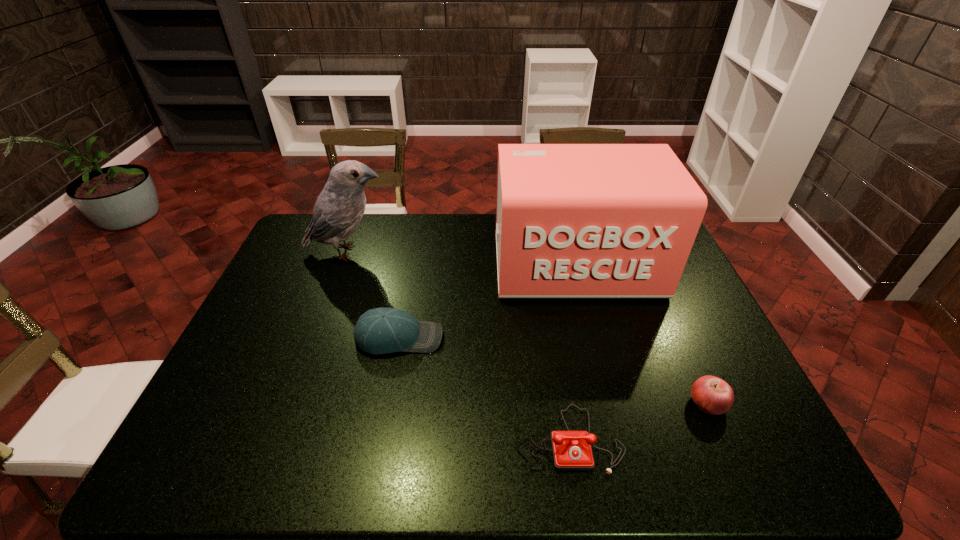
I want to click on vacant area that lies between the shortest object and the apple, so click(638, 421).

Locate an element on the screen. Image resolution: width=960 pixels, height=540 pixels. free space between the telephone and the third farthest object is located at coordinates (484, 388).

Where is `the third closest object to the parrot`? The width and height of the screenshot is (960, 540). the third closest object to the parrot is located at coordinates (571, 450).

Identify which object is the fourth nearest to the parrot. Please provide its 2D coordinates. Your answer should be formatted as a tuple, i.e. [(x, y)], where the tuple contains the x and y coordinates of a point satisfying the conditions above.

[(712, 395)]

The height and width of the screenshot is (540, 960). Identify the location of vacant space that satisfies the following two spatial constraints: 1. on the front-facing side of the third farthest object; 2. on the right side of the parrot. (317, 338).

I want to click on vacant area in the image that satisfies the following two spatial constraints: 1. on the front-facing side of the parrot; 2. on the left side of the apple, so click(293, 403).

Find the location of a particular element. free region that satisfies the following two spatial constraints: 1. on the front-facing side of the parrot; 2. on the back side of the apple is located at coordinates (293, 403).

Where is `vacant area in the image that satisfies the following two spatial constraints: 1. on the surface of the box where the text is embossed; 2. on the right side of the apple`? Image resolution: width=960 pixels, height=540 pixels. vacant area in the image that satisfies the following two spatial constraints: 1. on the surface of the box where the text is embossed; 2. on the right side of the apple is located at coordinates (612, 403).

Locate an element on the screen. free spot that satisfies the following two spatial constraints: 1. on the front side of the third farthest object; 2. on the left side of the apple is located at coordinates click(x=387, y=403).